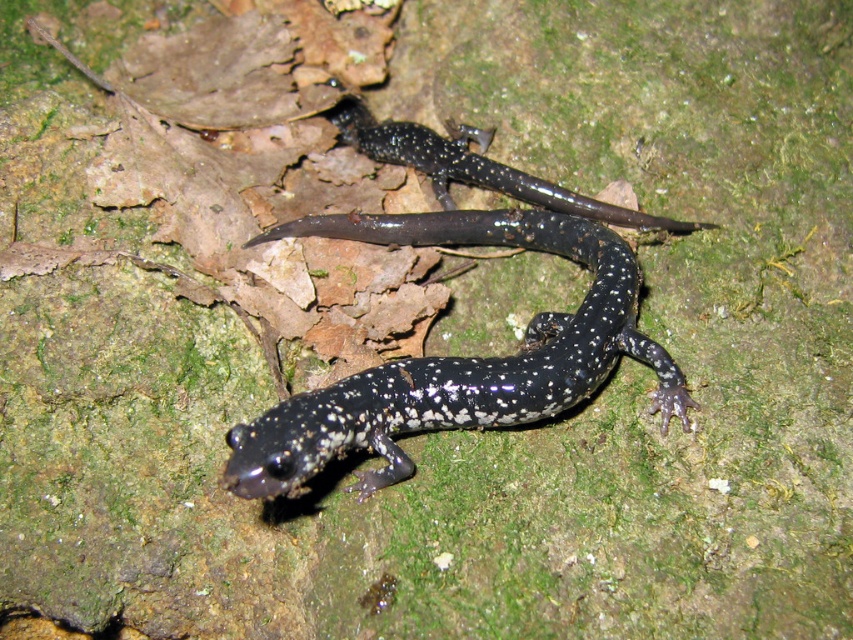
Is shiny black salamander at center taller than speckled glossy salamander at center?

Indeed, shiny black salamander at center has a greater height compared to speckled glossy salamander at center.

Is shiny black salamander at center closer to the viewer compared to speckled glossy salamander at center?

Yes, shiny black salamander at center is in front of speckled glossy salamander at center.

Is point (498, 392) closer to viewer compared to point (490, 132)?

Yes.

The height and width of the screenshot is (640, 853). Find the location of `shiny black salamander at center`. shiny black salamander at center is located at coordinates (456, 356).